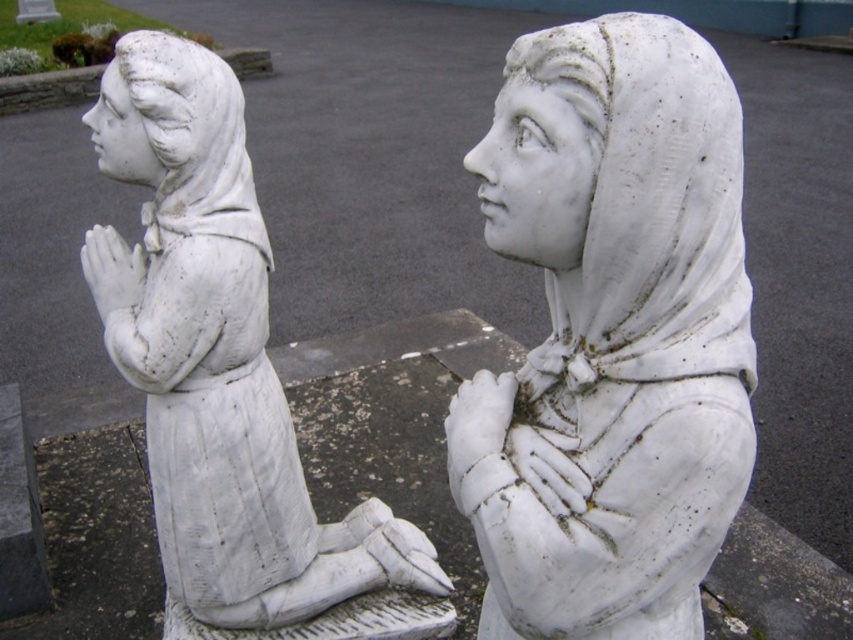
You are an art conservator assessing the statues in the image. Which statue, the white marble statue at center or the white marble statue at upper left, requires more frequent maintenance due to its height?

The white marble statue at center is taller than the white marble statue at upper left, so it likely requires more frequent maintenance due to its greater height, which may lead to more exposure to environmental factors.

You are a maintenance worker who needs to measure the distance between the two kneeling stone statues. According to the image, how far apart are the white marble statue at left and the other statue on the right?

The white marble statue at left and the other statue on the right are 4.44 feet apart.